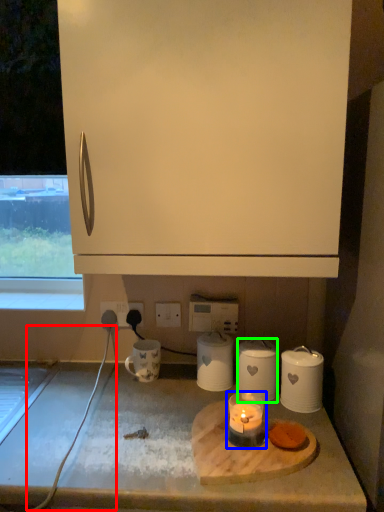
Question: Estimate the real-world distances between objects in this image. Which object is farther from wire (highlighted by a red box), candle holder (highlighted by a blue box) or kitchen appliance (highlighted by a green box)?

Choices:
 (A) candle holder
 (B) kitchen appliance

Answer: (B)